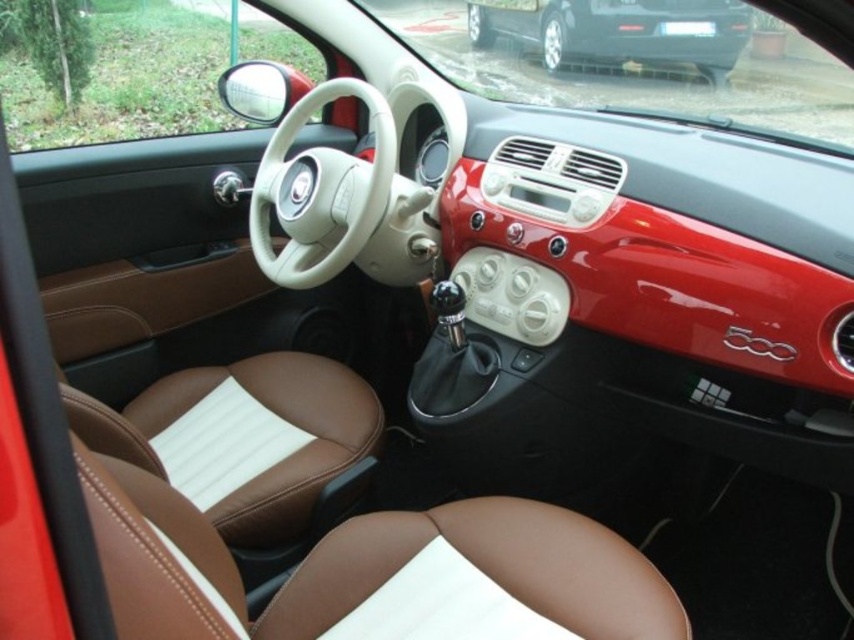
Does leather/smooth steering wheel at center appear over matte black car at upper center?

Actually, leather/smooth steering wheel at center is below matte black car at upper center.

Is leather/smooth steering wheel at center taller than matte black car at upper center?

No.

Is point (341, 253) positioned after point (583, 60)?

That is False.

Identify the location of leather/smooth steering wheel at center. (320, 192).